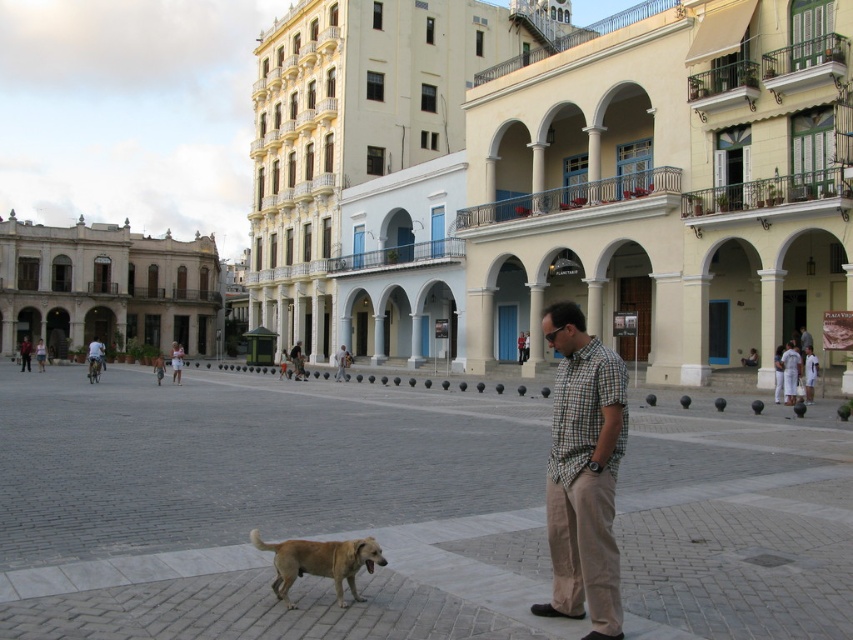
Who is taller, brown fur dog at center or checkered fabric shirt at center?

With more height is checkered fabric shirt at center.

Is point (22, 493) more distant than point (291, 364)?

No.

Find the location of a particular element. The width and height of the screenshot is (853, 640). brown fur dog at center is located at coordinates (267, 506).

Is golden fur dog at lower center above checkered fabric shirt at center?

Actually, golden fur dog at lower center is below checkered fabric shirt at center.

Is golden fur dog at lower center below checkered fabric shirt at center?

Yes, golden fur dog at lower center is below checkered fabric shirt at center.

Which is behind, point (300, 576) or point (300, 352)?

Point (300, 352)

The width and height of the screenshot is (853, 640). In order to click on golden fur dog at lower center in this screenshot , I will do `click(318, 563)`.

Who is positioned more to the right, beige stone building at left or golden fur dog at lower center?

Positioned to the right is golden fur dog at lower center.

Between beige stone building at left and golden fur dog at lower center, which one is positioned higher?

beige stone building at left

Does point (70, 336) come in front of point (375, 545)?

That is False.

Find the location of a particular element. This screenshot has height=640, width=853. beige stone building at left is located at coordinates (106, 288).